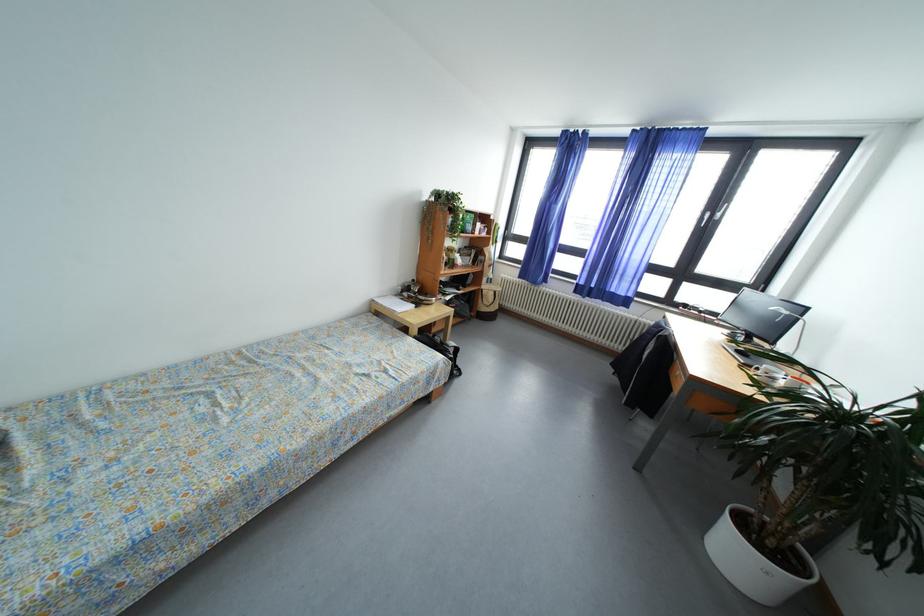
Find where to lift the black backpack. Please return your answer as a coordinate pair (x, y).

(441, 350)